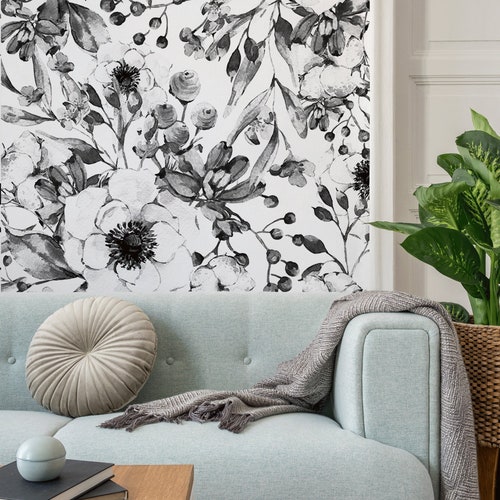
I want to click on door, so click(x=422, y=99).